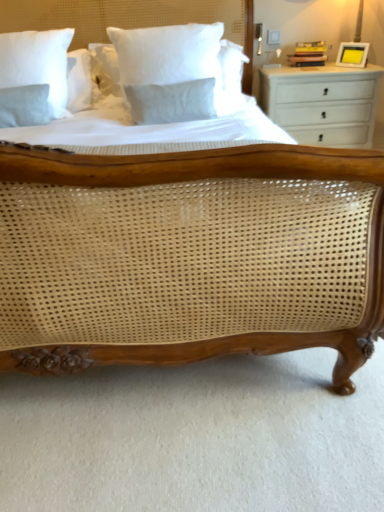
Question: Which direction should I rotate to face white cotton pillow at upper center, acting as the second pillow starting from the back, — up or down?

Choices:
 (A) up
 (B) down

Answer: (A)

Question: Does white painted wood chest of drawers at right appear on the right side of yellow matte picture frame at upper right?

Choices:
 (A) no
 (B) yes

Answer: (A)

Question: From the image's perspective, is white painted wood chest of drawers at right below yellow matte picture frame at upper right?

Choices:
 (A) no
 (B) yes

Answer: (B)

Question: Is white painted wood chest of drawers at right positioned with its back to yellow matte picture frame at upper right?

Choices:
 (A) no
 (B) yes

Answer: (A)

Question: Could you tell me if white painted wood chest of drawers at right is turned towards yellow matte picture frame at upper right?

Choices:
 (A) no
 (B) yes

Answer: (A)

Question: Is white painted wood chest of drawers at right wider than yellow matte picture frame at upper right?

Choices:
 (A) no
 (B) yes

Answer: (B)

Question: Can you confirm if white painted wood chest of drawers at right is thinner than yellow matte picture frame at upper right?

Choices:
 (A) no
 (B) yes

Answer: (A)

Question: Can you confirm if white cotton pillow at upper center, the first pillow when ordered from front to back, is thinner than white cotton pillow at upper left, acting as the first pillow starting from the left?

Choices:
 (A) yes
 (B) no

Answer: (A)

Question: Is the position of white cotton pillow at upper center, the first pillow when ordered from front to back, less distant than that of white cotton pillow at upper left, acting as the first pillow starting from the back?

Choices:
 (A) no
 (B) yes

Answer: (B)

Question: Is white cotton pillow at upper center, arranged as the 2th pillow when viewed from the left, not near white cotton pillow at upper left, acting as the first pillow starting from the back?

Choices:
 (A) yes
 (B) no

Answer: (B)

Question: Is white cotton pillow at upper center, acting as the second pillow starting from the back, wider than white cotton pillow at upper left, the second pillow in the right-to-left sequence?

Choices:
 (A) yes
 (B) no

Answer: (B)

Question: From a real-world perspective, is white cotton pillow at upper center, the first pillow when ordered from front to back, physically above white cotton pillow at upper left, which ranks as the 2th pillow in front-to-back order?

Choices:
 (A) no
 (B) yes

Answer: (A)

Question: From the image's perspective, does white cotton pillow at upper center, arranged as the 2th pillow when viewed from the left, appear higher than white cotton pillow at upper left, acting as the first pillow starting from the back?

Choices:
 (A) no
 (B) yes

Answer: (A)

Question: Considering the relative sizes of white cotton pillow at upper left, which ranks as the 2th pillow in front-to-back order, and yellow matte picture frame at upper right in the image provided, is white cotton pillow at upper left, which ranks as the 2th pillow in front-to-back order, wider than yellow matte picture frame at upper right?

Choices:
 (A) yes
 (B) no

Answer: (A)